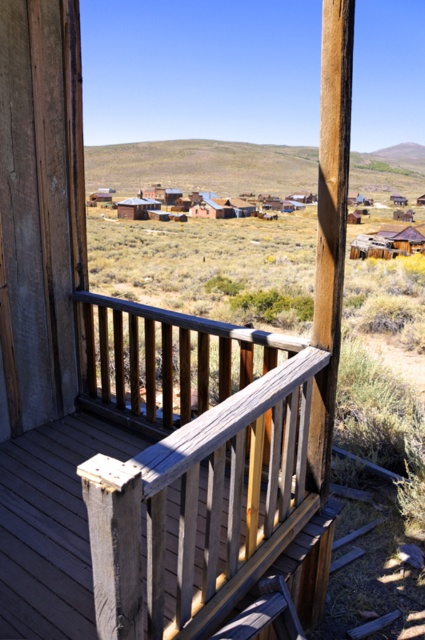
From the picture: Is weathered wood rail at center bigger than rustic wooden hut at center?

No, weathered wood rail at center is not bigger than rustic wooden hut at center.

Between weathered wood rail at center and rustic wooden hut at center, which one is positioned higher?

rustic wooden hut at center

Which is behind, point (107, 531) or point (141, 218)?

The point (141, 218) is behind.

Locate an element on the screen. weathered wood rail at center is located at coordinates (193, 468).

Can you confirm if wooden hut at center is bigger than rustic wooden hut at center?

Indeed, wooden hut at center has a larger size compared to rustic wooden hut at center.

Is wooden hut at center to the right of rustic wooden hut at center from the viewer's perspective?

Correct, you'll find wooden hut at center to the right of rustic wooden hut at center.

Who is more forward, (414, 241) or (149, 202)?

Positioned in front is point (414, 241).

At what (x,y) coordinates should I click in order to perform the action: click on wooden hut at center. Please return your answer as a coordinate pair (x, y). The image size is (425, 640). Looking at the image, I should click on (388, 241).

Which is behind, point (302, 353) or point (401, 234)?

Positioned behind is point (401, 234).

Does weathered wood rail at center appear on the left side of wooden hut at center?

Correct, you'll find weathered wood rail at center to the left of wooden hut at center.

Which is behind, point (167, 410) or point (407, 248)?

Point (407, 248)

This screenshot has width=425, height=640. I want to click on weathered wood rail at center, so click(193, 468).